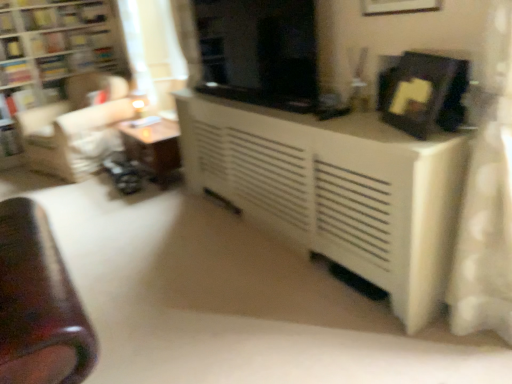
Question: Which direction should I rotate to look at matte black picture frame at upper center, the first picture frame viewed from the top, — up or down?

Choices:
 (A) up
 (B) down

Answer: (A)

Question: From a real-world perspective, does wooden bookshelf at left sit lower than hardcover book at left, which is counted as the sixth book, starting from the top?

Choices:
 (A) no
 (B) yes

Answer: (A)

Question: Is wooden bookshelf at left positioned behind hardcover book at left, the 2th book when ordered from bottom to top?

Choices:
 (A) no
 (B) yes

Answer: (A)

Question: Is hardcover book at left, which is counted as the sixth book, starting from the top, at the back of wooden bookshelf at left?

Choices:
 (A) yes
 (B) no

Answer: (A)

Question: From the image's perspective, is wooden bookshelf at left on top of hardcover book at left, the 2th book when ordered from bottom to top?

Choices:
 (A) no
 (B) yes

Answer: (B)

Question: Is wooden bookshelf at left with hardcover book at left, the 2th book when ordered from bottom to top?

Choices:
 (A) yes
 (B) no

Answer: (B)

Question: Would you say wooden bookshelf at left is outside hardcover book at left, which is counted as the sixth book, starting from the top?

Choices:
 (A) no
 (B) yes

Answer: (B)

Question: Considering the relative positions of hardcover book at left, the 2th book when ordered from bottom to top, and hardcover book at upper left, the 4th book from the bottom, in the image provided, is hardcover book at left, the 2th book when ordered from bottom to top, in front of hardcover book at upper left, the 4th book from the bottom,?

Choices:
 (A) no
 (B) yes

Answer: (A)

Question: Does hardcover book at left, which is counted as the sixth book, starting from the top, contain hardcover book at upper left, the 4th book when ordered from top to bottom?

Choices:
 (A) yes
 (B) no

Answer: (B)

Question: Considering the relative sizes of hardcover book at left, which is counted as the sixth book, starting from the top, and hardcover book at upper left, the 4th book when ordered from top to bottom, in the image provided, is hardcover book at left, which is counted as the sixth book, starting from the top, shorter than hardcover book at upper left, the 4th book when ordered from top to bottom,?

Choices:
 (A) no
 (B) yes

Answer: (A)

Question: Does hardcover book at left, which is counted as the sixth book, starting from the top, touch hardcover book at upper left, the 4th book when ordered from top to bottom?

Choices:
 (A) yes
 (B) no

Answer: (B)

Question: Is hardcover book at left, the 2th book when ordered from bottom to top, turned away from hardcover book at upper left, the 4th book when ordered from top to bottom?

Choices:
 (A) no
 (B) yes

Answer: (A)

Question: Is hardcover book at left, which is counted as the sixth book, starting from the top, further to camera compared to hardcover book at upper left, the 4th book from the bottom?

Choices:
 (A) no
 (B) yes

Answer: (B)

Question: Is matte black picture frame at upper center, the first picture frame viewed from the top, shorter than wooden table at left, positioned as the first table in left-to-right order?

Choices:
 (A) no
 (B) yes

Answer: (B)